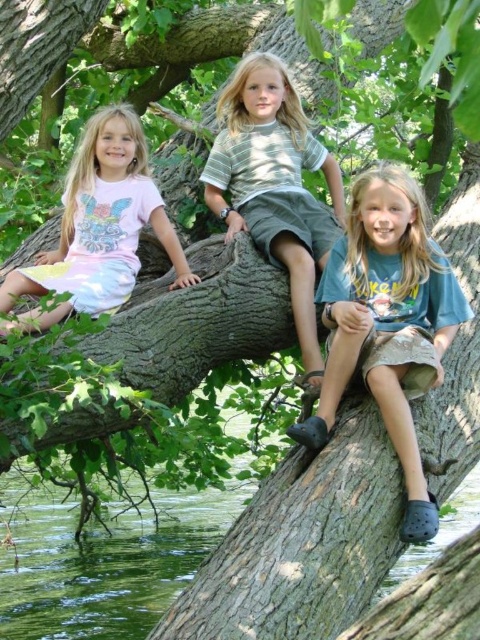
You are a photographer standing 5 meters away from the two children wearing blue cotton shirt at center and striped cotton shirt at center. You want to take a photo of them together. Can you fit both of them in your camera frame if your camera has a maximum field of view of 4 meters?

The blue cotton shirt at center is 3.19 meters from striped cotton shirt at center. Since the distance between them is less than the camera frame field of view of 4 meters, both can be captured in the same frame.

You are standing in front of the tree branch where the children are sitting. You notice two points marked on the branch. The first point is at coordinates point (231, 148) and the second is at point (87, 244). Which point is closer to you?

The point at coordinates point (231, 148) is closer to you because it is further to the viewer than point (87, 244).

What is the color of the shirt worn by the child located at the center position marked by point (387, 323)?

The child at the center position marked by point (387, 323) is wearing a blue cotton shirt.